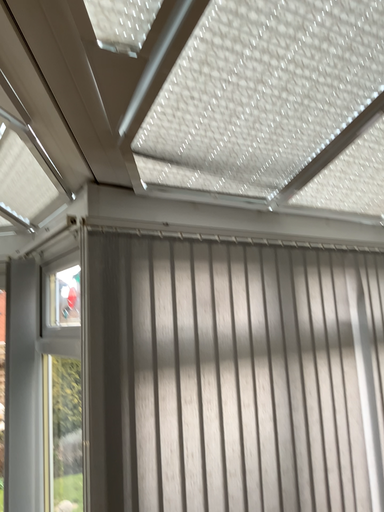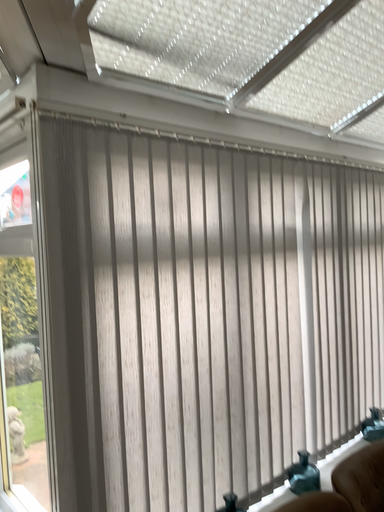
Question: How did the camera likely rotate when shooting the video?

Choices:
 (A) rotated left
 (B) rotated right

Answer: (B)